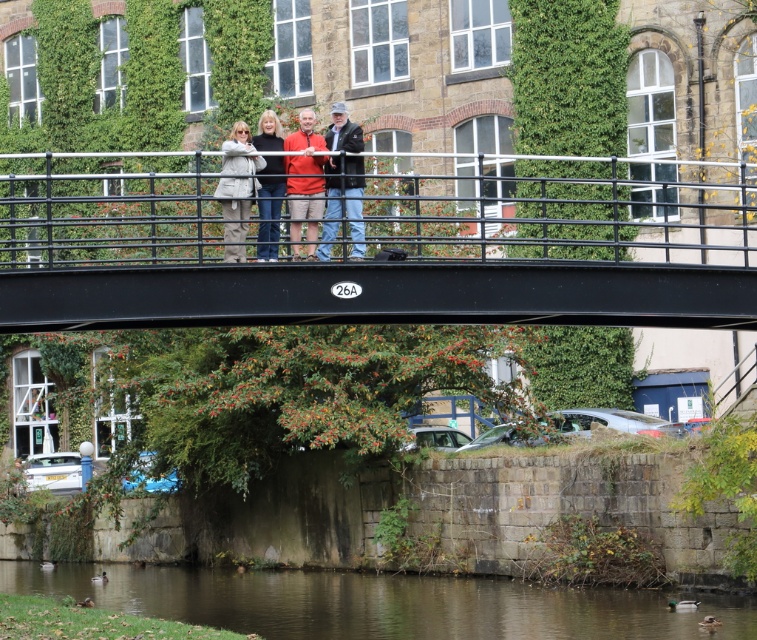
Looking at this image, you are standing on the black metal bridge at center and looking towards the light gray fabric jacket at center. Which object is closer to you?

The black metal bridge at center is closer to you than the light gray fabric jacket at center.